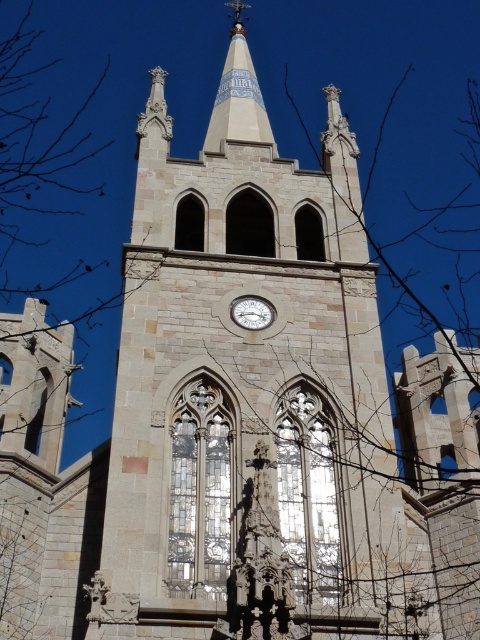
Question: Is white stone spire at upper center thinner than metallic silver clock at center?

Choices:
 (A) yes
 (B) no

Answer: (B)

Question: Is white stone spire at upper center below metallic silver clock at center?

Choices:
 (A) no
 (B) yes

Answer: (A)

Question: Which point appears farthest from the camera in this image?

Choices:
 (A) (245, 6)
 (B) (263, 308)

Answer: (A)

Question: Does white stone spire at upper center have a lesser width compared to metallic silver clock at center?

Choices:
 (A) no
 (B) yes

Answer: (A)